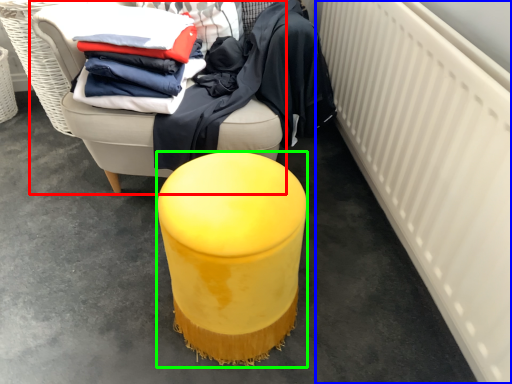
Question: Which object is the closest to the furniture (highlighted by a red box)? Choose among these: radiator (highlighted by a blue box) or furniture (highlighted by a green box).

Choices:
 (A) radiator
 (B) furniture

Answer: (B)